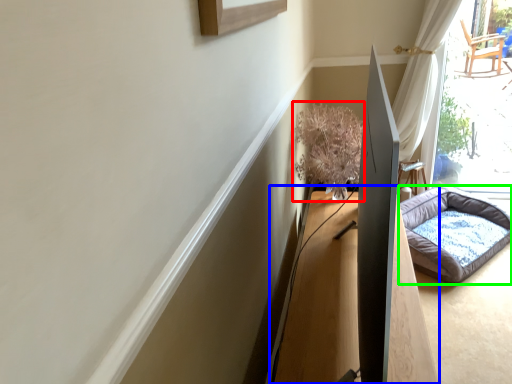
Question: Which object is positioned closest to plant (highlighted by a red box)? Select from table (highlighted by a blue box) and dog bed (highlighted by a green box).

Choices:
 (A) table
 (B) dog bed

Answer: (A)